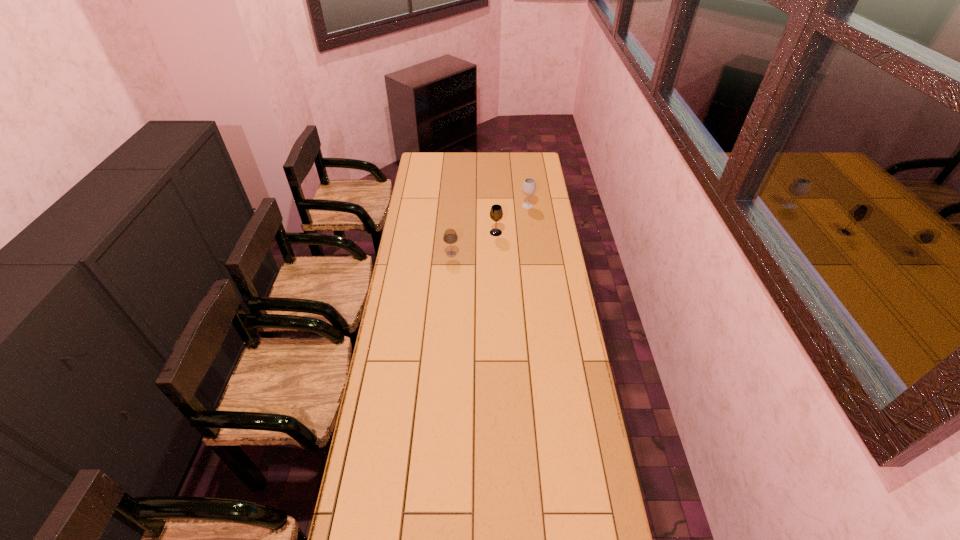
At what (x,y) coordinates should I click in order to perform the action: click on the rightmost wineglass. Please return your answer as a coordinate pair (x, y). Looking at the image, I should click on (529, 186).

Locate an element on the screen. The image size is (960, 540). the farthest object is located at coordinates (529, 186).

You are a GUI agent. You are given a task and a screenshot of the screen. Output one action in this format:
    pyautogui.click(x=<x>, y=<y>)
    Task: Click on the second farthest object
    The image size is (960, 540).
    Given the screenshot: What is the action you would take?
    pyautogui.click(x=496, y=213)

You are a GUI agent. You are given a task and a screenshot of the screen. Output one action in this format:
    pyautogui.click(x=<x>, y=<y>)
    Task: Click on the second wineglass from right to left
    
    Given the screenshot: What is the action you would take?
    pyautogui.click(x=496, y=213)

Locate an element on the screen. Image resolution: width=960 pixels, height=540 pixels. the leftmost object is located at coordinates (450, 236).

Identify the location of the nearest wineglass. (450, 236).

This screenshot has height=540, width=960. Find the location of `vacant area situated on the front of the farthest object`. vacant area situated on the front of the farthest object is located at coordinates (529, 217).

In order to click on free region located 0.060m on the right of the second wineglass from right to left in this screenshot , I will do `click(514, 233)`.

Where is `vacant area located 0.250m on the back of the nearest wineglass`? vacant area located 0.250m on the back of the nearest wineglass is located at coordinates (454, 218).

I want to click on object situated at the right edge, so click(x=529, y=186).